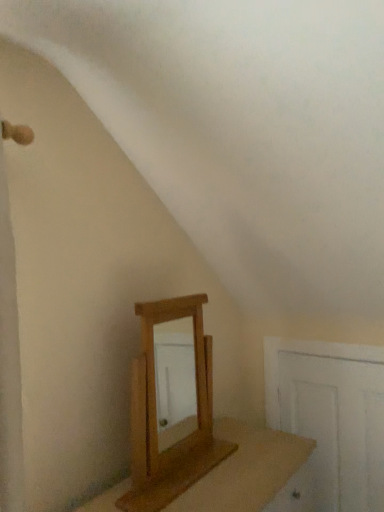
Question: Is wooden table at center inside light brown wooden mirror at center?

Choices:
 (A) no
 (B) yes

Answer: (A)

Question: Does light brown wooden mirror at center have a larger size compared to wooden table at center?

Choices:
 (A) no
 (B) yes

Answer: (A)

Question: Is light brown wooden mirror at center not within wooden table at center?

Choices:
 (A) yes
 (B) no

Answer: (A)

Question: Is light brown wooden mirror at center thinner than wooden table at center?

Choices:
 (A) no
 (B) yes

Answer: (B)

Question: Is light brown wooden mirror at center shorter than wooden table at center?

Choices:
 (A) yes
 (B) no

Answer: (B)

Question: From the image's perspective, is light brown wooden mirror at center on wooden table at center?

Choices:
 (A) no
 (B) yes

Answer: (B)

Question: Is wooden table at center with light brown wooden mirror at center?

Choices:
 (A) no
 (B) yes

Answer: (A)

Question: Is wooden table at center at the left side of light brown wooden mirror at center?

Choices:
 (A) no
 (B) yes

Answer: (A)

Question: Is wooden table at center turned away from light brown wooden mirror at center?

Choices:
 (A) yes
 (B) no

Answer: (B)

Question: Is wooden table at center aimed at light brown wooden mirror at center?

Choices:
 (A) yes
 (B) no

Answer: (B)

Question: From the image's perspective, is wooden table at center above light brown wooden mirror at center?

Choices:
 (A) no
 (B) yes

Answer: (A)

Question: Can you confirm if wooden table at center is smaller than light brown wooden mirror at center?

Choices:
 (A) no
 (B) yes

Answer: (A)

Question: Is white wooden door at lower right a part of wooden table at center?

Choices:
 (A) no
 (B) yes

Answer: (A)